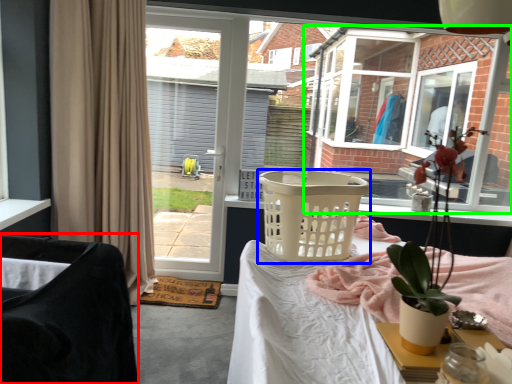
Question: Estimate the real-world distances between objects in this image. Which object is farther from chair (highlighted by a red box), basket (highlighted by a blue box) or window (highlighted by a green box)?

Choices:
 (A) basket
 (B) window

Answer: (B)